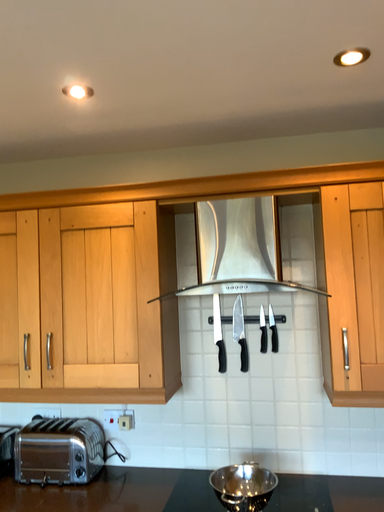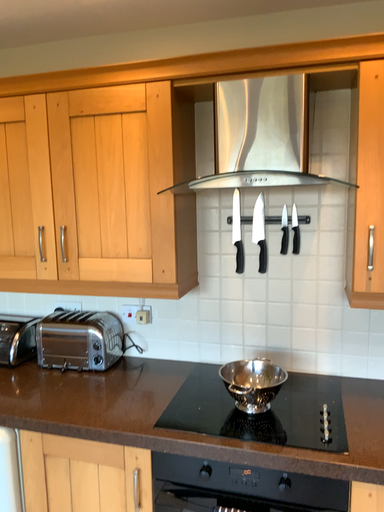
Question: How did the camera likely rotate when shooting the video?

Choices:
 (A) rotated upward
 (B) rotated downward

Answer: (B)